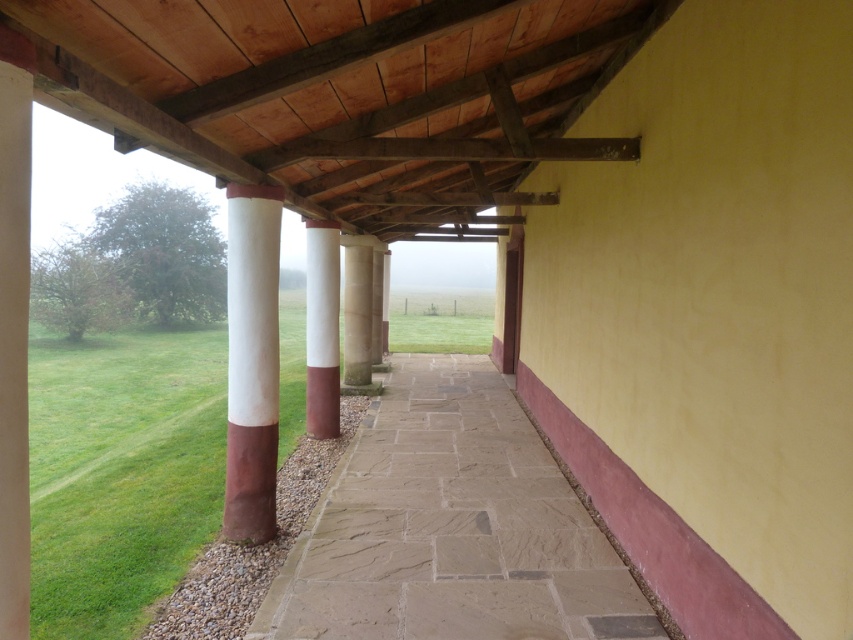
Between white glossy column at center and white painted wood column at center, which one has less height?

white painted wood column at center is shorter.

Which is above, white glossy column at center or white painted wood column at center?

white painted wood column at center

You are a GUI agent. You are given a task and a screenshot of the screen. Output one action in this format:
    pyautogui.click(x=<x>, y=<y>)
    Task: Click on the white glossy column at center
    
    Given the screenshot: What is the action you would take?
    pyautogui.click(x=251, y=362)

What do you see at coordinates (120, 472) in the screenshot? I see `green grass at lower left` at bounding box center [120, 472].

Which is below, green grass at lower left or white painted wood column at center?

Positioned lower is green grass at lower left.

Find the location of `green grass at lower left`. green grass at lower left is located at coordinates (120, 472).

Can you confirm if white painted wood column at center is bigger than white marble pillar at center?

No.

In the scene shown: Is white painted wood column at center shorter than white marble pillar at center?

Incorrect, white painted wood column at center's height does not fall short of white marble pillar at center's.

The height and width of the screenshot is (640, 853). What do you see at coordinates (322, 328) in the screenshot?
I see `white painted wood column at center` at bounding box center [322, 328].

This screenshot has width=853, height=640. In order to click on white painted wood column at center in this screenshot , I will do `click(322, 328)`.